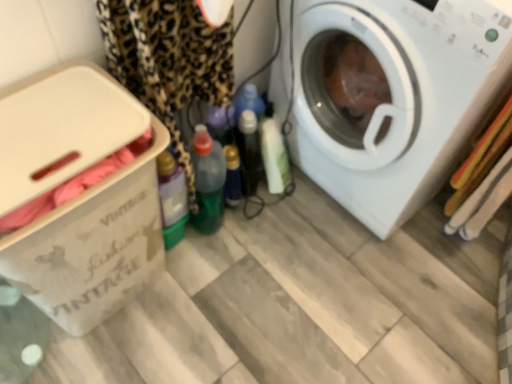
Question: Should I look upward or downward to see green plastic bottle at center, which is the 1th bottle from left to right?

Choices:
 (A) down
 (B) up

Answer: (B)

Question: Is there a large distance between translucent plastic bottle at center, the 1th bottle positioned from the right, and white plastic washing machine at right?

Choices:
 (A) no
 (B) yes

Answer: (A)

Question: Considering the relative sizes of translucent plastic bottle at center, the 1th bottle positioned from the right, and white plastic washing machine at right in the image provided, is translucent plastic bottle at center, the 1th bottle positioned from the right, taller than white plastic washing machine at right?

Choices:
 (A) no
 (B) yes

Answer: (A)

Question: Is the depth of translucent plastic bottle at center, the 1th bottle positioned from the right, greater than that of white plastic washing machine at right?

Choices:
 (A) yes
 (B) no

Answer: (A)

Question: Can you see translucent plastic bottle at center, the 2th bottle positioned from the left, touching white plastic washing machine at right?

Choices:
 (A) yes
 (B) no

Answer: (B)

Question: Does translucent plastic bottle at center, the 2th bottle positioned from the left, have a larger size compared to white plastic washing machine at right?

Choices:
 (A) no
 (B) yes

Answer: (A)

Question: Is translucent plastic bottle at center, the 2th bottle positioned from the left, wider than white plastic washing machine at right?

Choices:
 (A) no
 (B) yes

Answer: (A)

Question: Does beige cardboard box at left have a greater height compared to leopard print fabric at left?

Choices:
 (A) yes
 (B) no

Answer: (B)

Question: Does beige cardboard box at left have a larger size compared to leopard print fabric at left?

Choices:
 (A) no
 (B) yes

Answer: (B)

Question: Does beige cardboard box at left have a lesser width compared to leopard print fabric at left?

Choices:
 (A) no
 (B) yes

Answer: (A)

Question: Is leopard print fabric at left completely or partially inside beige cardboard box at left?

Choices:
 (A) no
 (B) yes

Answer: (A)

Question: Is beige cardboard box at left oriented towards leopard print fabric at left?

Choices:
 (A) no
 (B) yes

Answer: (A)

Question: Considering the relative sizes of beige cardboard box at left and leopard print fabric at left in the image provided, is beige cardboard box at left shorter than leopard print fabric at left?

Choices:
 (A) no
 (B) yes

Answer: (B)

Question: Could white plastic washing machine at right be considered to be inside beige cardboard box at left?

Choices:
 (A) no
 (B) yes

Answer: (A)